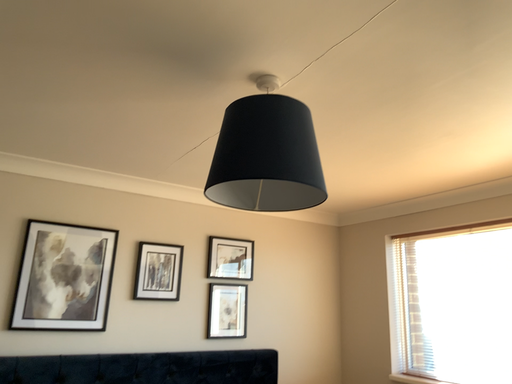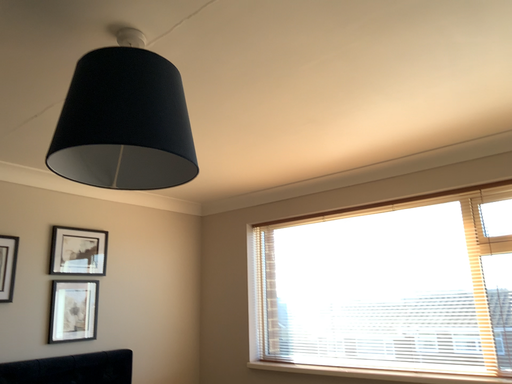
Question: How did the camera likely rotate when shooting the video?

Choices:
 (A) rotated right
 (B) rotated left

Answer: (A)